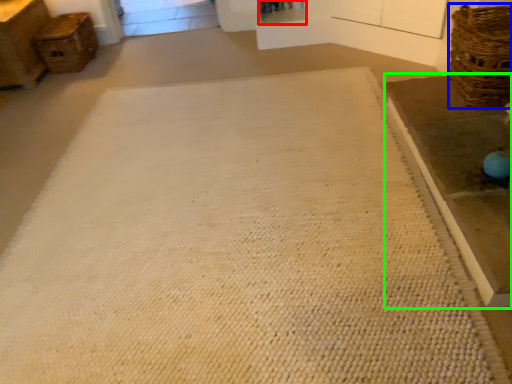
Question: Considering the real-world distances, which object is farthest from shelf (highlighted by a red box)? basket (highlighted by a blue box) or table (highlighted by a green box)?

Choices:
 (A) basket
 (B) table

Answer: (B)